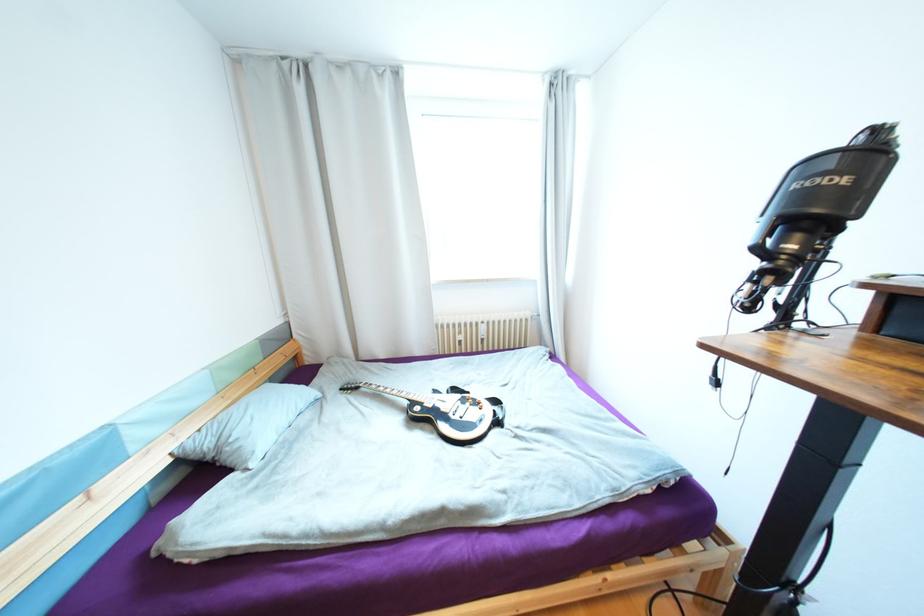
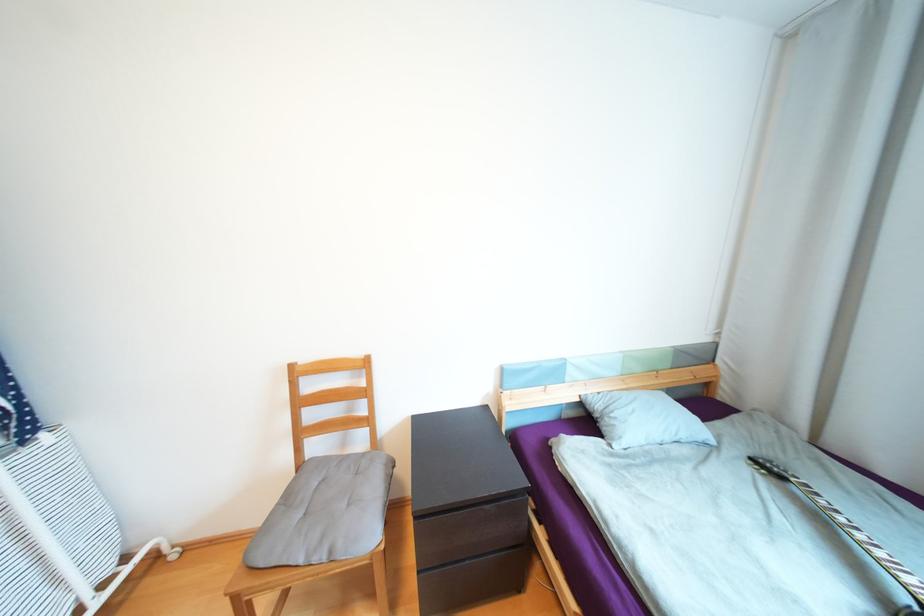
The point at (178, 448) is marked in the first image. Where is the corresponding point in the second image?

(588, 392)